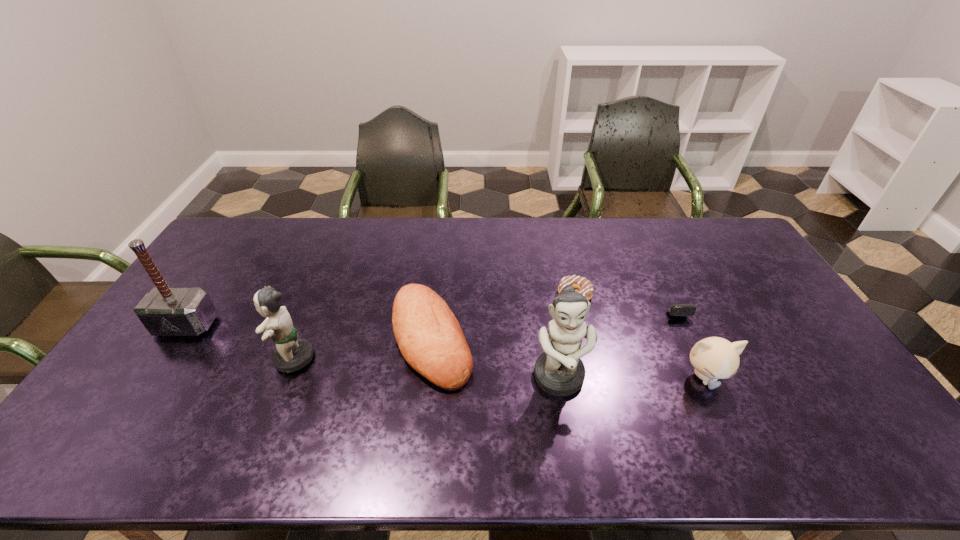
Locate an element on the screen. The image size is (960, 540). the second object from left to right is located at coordinates (291, 354).

Find the location of a particular element. This screenshot has width=960, height=540. the shorter figurine is located at coordinates (291, 354).

Identify the location of the right figurine. (559, 371).

This screenshot has height=540, width=960. What are the coordinates of `the shortest object` in the screenshot? It's located at (584, 286).

Find the location of a particular element. webcam is located at coordinates (679, 309).

Find the location of a particular element. Image resolution: width=960 pixels, height=540 pixels. hammer is located at coordinates (164, 311).

Find the location of a particular element. This screenshot has width=960, height=540. bread is located at coordinates (430, 338).

Find the location of a particular element. The image size is (960, 540). the fifth object from right to left is located at coordinates (430, 338).

Locate an element on the screen. This screenshot has width=960, height=540. the fourth shortest object is located at coordinates (713, 358).

Identify the location of vacant region located 0.390m on the front-facing side of the sixth object from right to left. Image resolution: width=960 pixels, height=540 pixels. (130, 358).